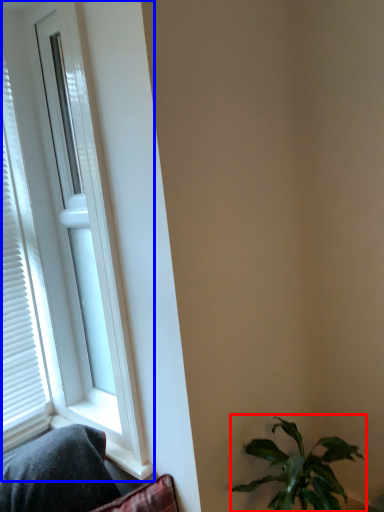
Question: Which of the following is the farthest to the observer, houseplant (highlighted by a red box) or window (highlighted by a blue box)?

Choices:
 (A) houseplant
 (B) window

Answer: (B)